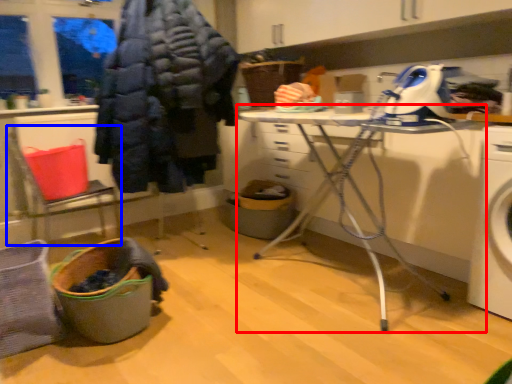
Question: Which object is closer to the camera taking this photo, table (highlighted by a red box) or chair (highlighted by a blue box)?

Choices:
 (A) table
 (B) chair

Answer: (A)